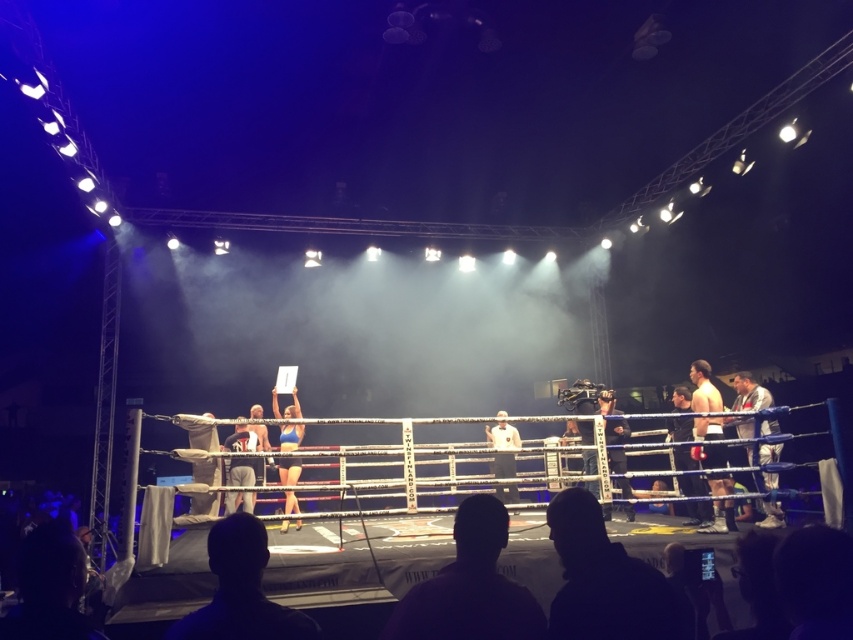
Question: Can you confirm if silhouette leather jacket at lower right is positioned below blue fabric shorts at center?

Choices:
 (A) yes
 (B) no

Answer: (B)

Question: Which of these objects is positioned farthest from the muscular tan skin at center?

Choices:
 (A) silhouette leather jacket at lower right
 (B) dark hair at center
 (C) light brown leather jacket at right
 (D) white fabric at center

Answer: (B)

Question: Can you confirm if dark hair at center is positioned below light brown leather jacket at right?

Choices:
 (A) no
 (B) yes

Answer: (A)

Question: From the image, what is the correct spatial relationship of blue fabric shorts at center in relation to white fabric at center?

Choices:
 (A) above
 (B) below

Answer: (A)

Question: Which of these objects is positioned farthest from the light brown leather jacket at right?

Choices:
 (A) muscular tan skin at center
 (B) white fabric at center
 (C) silhouette leather jacket at lower right
 (D) blue fabric shorts at center

Answer: (D)

Question: Among these points, which one is farthest from the camera?

Choices:
 (A) (515, 432)
 (B) (291, 438)

Answer: (A)